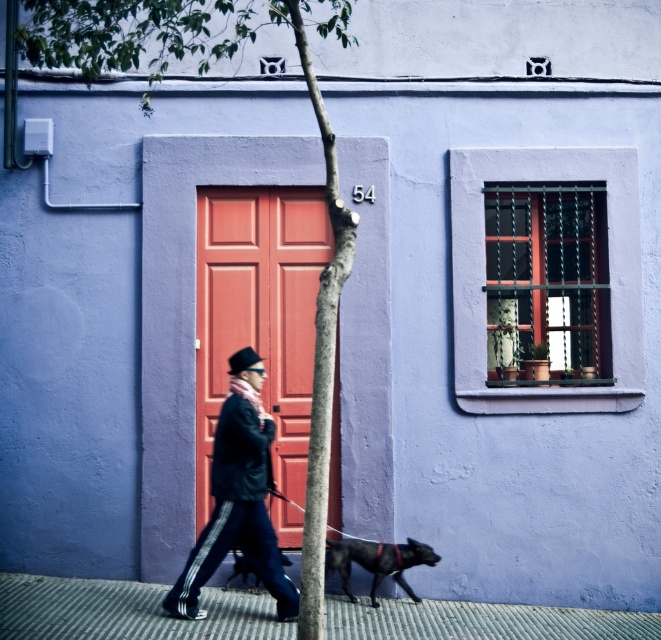
Question: In this image, where is green textured tree at center located relative to black leather jacket at center?

Choices:
 (A) right
 (B) left

Answer: (B)

Question: Which object is farther from the camera taking this photo?

Choices:
 (A) green textured tree at center
 (B) shiny black dog at center
 (C) ribbed concrete pavement at lower center
 (D) shiny black dog at lower center

Answer: (D)

Question: Does black leather jacket at center have a larger size compared to shiny black dog at lower center?

Choices:
 (A) no
 (B) yes

Answer: (B)

Question: Which object is farther from the camera taking this photo?

Choices:
 (A) shiny black dog at center
 (B) ribbed concrete pavement at lower center
 (C) green textured tree at center

Answer: (A)

Question: Does ribbed concrete pavement at lower center appear on the left side of shiny black dog at lower center?

Choices:
 (A) no
 (B) yes

Answer: (B)

Question: Estimate the real-world distances between objects in this image. Which object is farther from the shiny black dog at center?

Choices:
 (A) black leather jacket at center
 (B) green textured tree at center

Answer: (B)